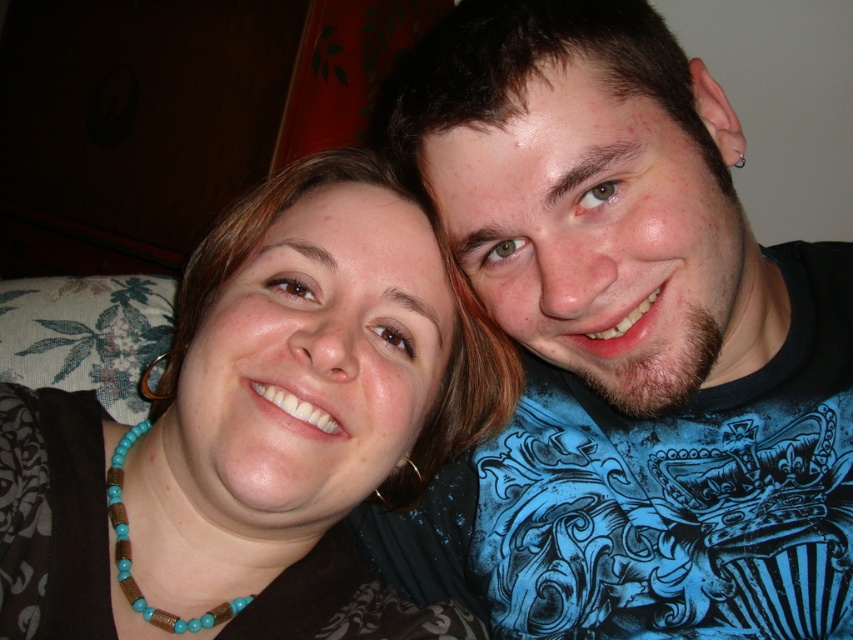
Based on the scene described, what is located at the coordinates point (258,429)?

The point (258,429) corresponds to brown fabric at center.